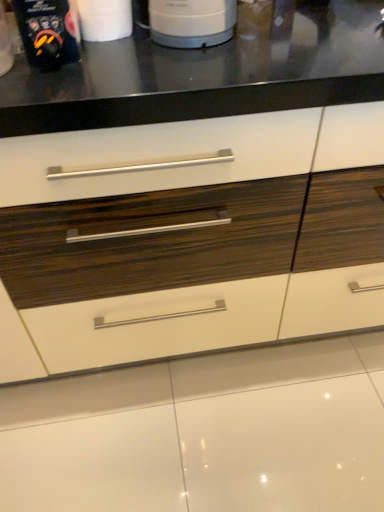
Question: Is point (x=119, y=33) positioned closer to the camera than point (x=62, y=51)?

Choices:
 (A) farther
 (B) closer

Answer: (A)

Question: From the image's perspective, relative to matte black coffee maker at upper left, is white matte paper towel at upper left above or below?

Choices:
 (A) below
 (B) above

Answer: (B)

Question: Which of these objects is positioned closest to the matte black coffee maker at upper left?

Choices:
 (A) white glossy drawer at center
 (B) white matte paper towel at upper left

Answer: (B)

Question: Based on their relative distances, which object is farther from the matte black coffee maker at upper left?

Choices:
 (A) white matte paper towel at upper left
 (B) white glossy drawer at center

Answer: (B)